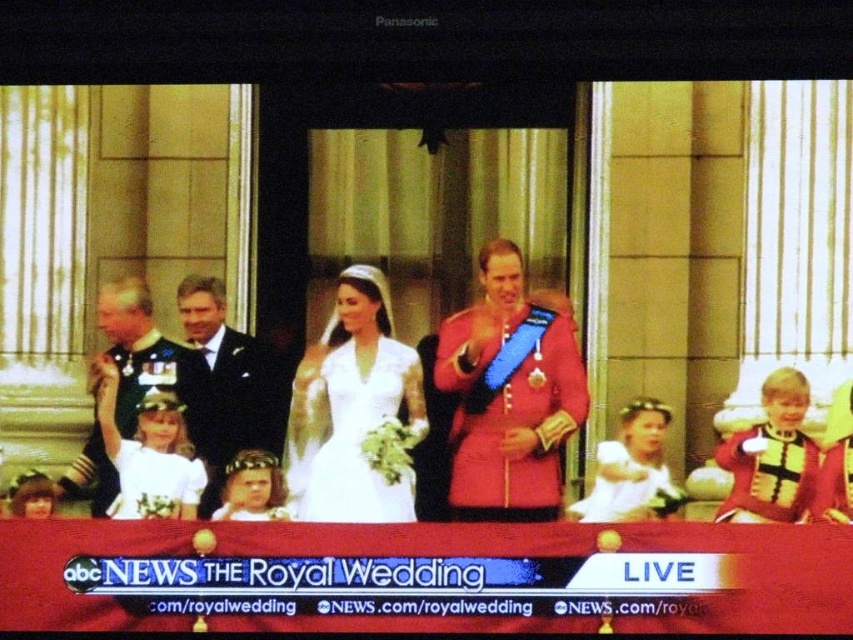
You are a guest at the royal wedding and notice two items at the center of the balcony. The shiny red coat at center and the white satin dress at center. Which item is closer to you?

The shiny red coat at center is closer to you because it is in front of the white satin dress at center.